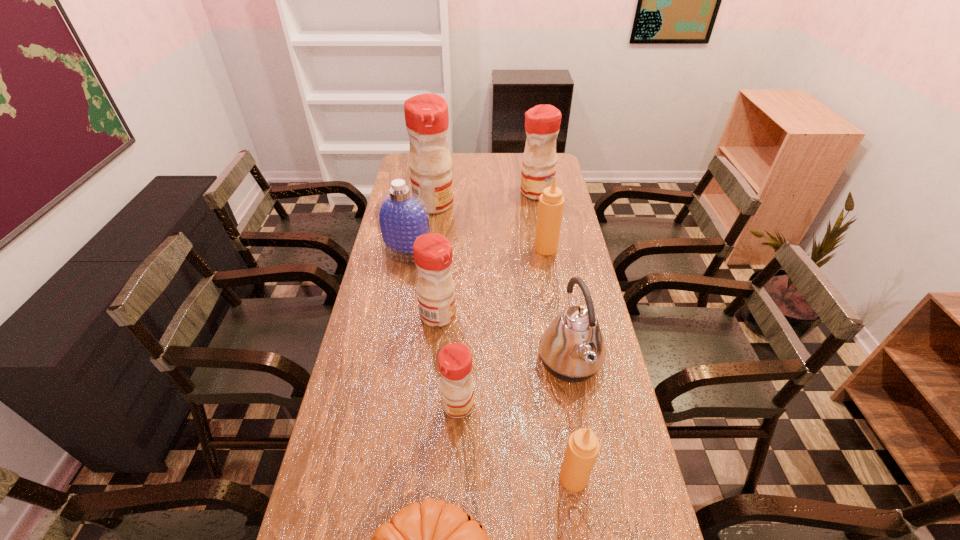
Locate an element on the screen. This screenshot has width=960, height=540. the tallest condiment is located at coordinates (426, 115).

Where is `the tallest object`? The width and height of the screenshot is (960, 540). the tallest object is located at coordinates (426, 115).

At what (x,y) coordinates should I click in order to perform the action: click on the eighth shortest object. Please return your answer as a coordinate pair (x, y). Looking at the image, I should click on (542, 122).

This screenshot has width=960, height=540. In order to click on the second tallest condiment in this screenshot , I will do `click(542, 122)`.

The image size is (960, 540). In order to click on the bigger tan condiment in this screenshot , I will do `click(551, 203)`.

The width and height of the screenshot is (960, 540). What are the coordinates of `the third farthest condiment` in the screenshot? It's located at (551, 203).

This screenshot has width=960, height=540. Find the location of `the second nearest red condiment`. the second nearest red condiment is located at coordinates (433, 255).

You are a GUI agent. You are given a task and a screenshot of the screen. Output one action in this format:
    pyautogui.click(x=<x>, y=<y>)
    Task: Click on the fourth farthest condiment
    The height and width of the screenshot is (540, 960).
    Given the screenshot: What is the action you would take?
    pyautogui.click(x=433, y=255)

Find the location of a particular element. This screenshot has width=960, height=540. kettle is located at coordinates (572, 348).

Locate an element on the screen. The width and height of the screenshot is (960, 540). cleansing agent is located at coordinates (402, 216).